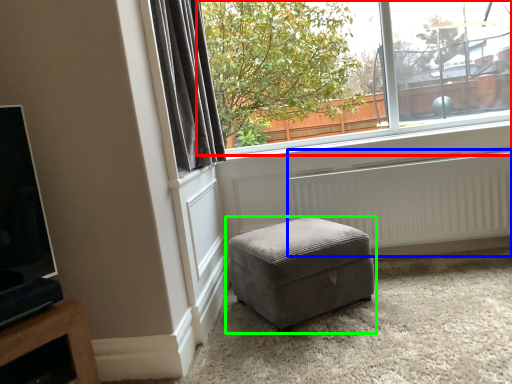
Question: Which object is positioned closest to window (highlighted by a red box)? Select from radiator (highlighted by a blue box) and studio couch (highlighted by a green box).

Choices:
 (A) radiator
 (B) studio couch

Answer: (A)